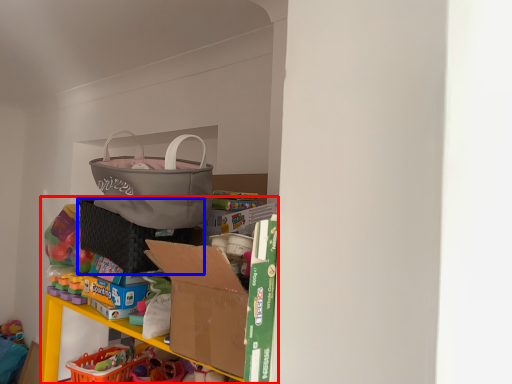
Question: Which of the following is the farthest to the observer, bookshelf (highlighted by a red box) or laundry basket (highlighted by a blue box)?

Choices:
 (A) bookshelf
 (B) laundry basket

Answer: (B)